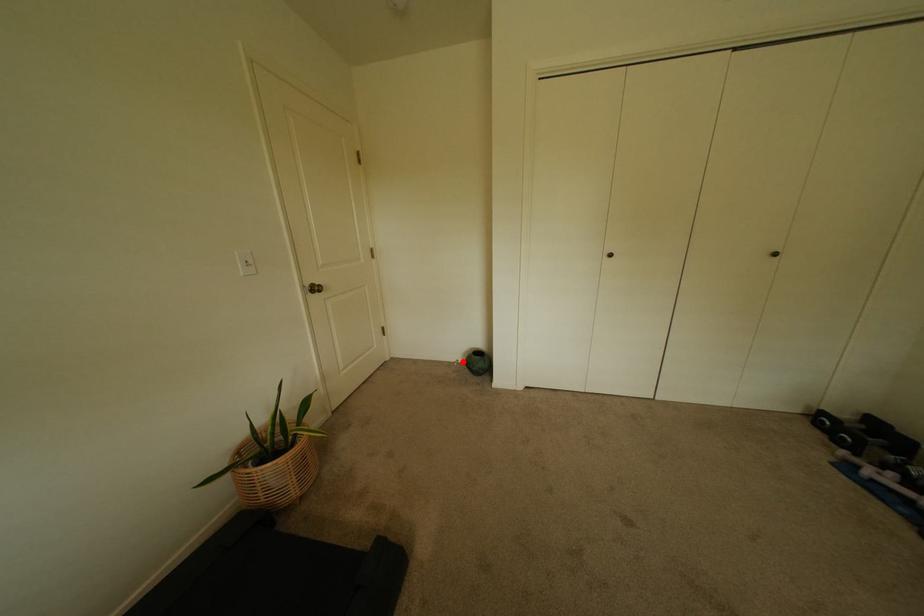
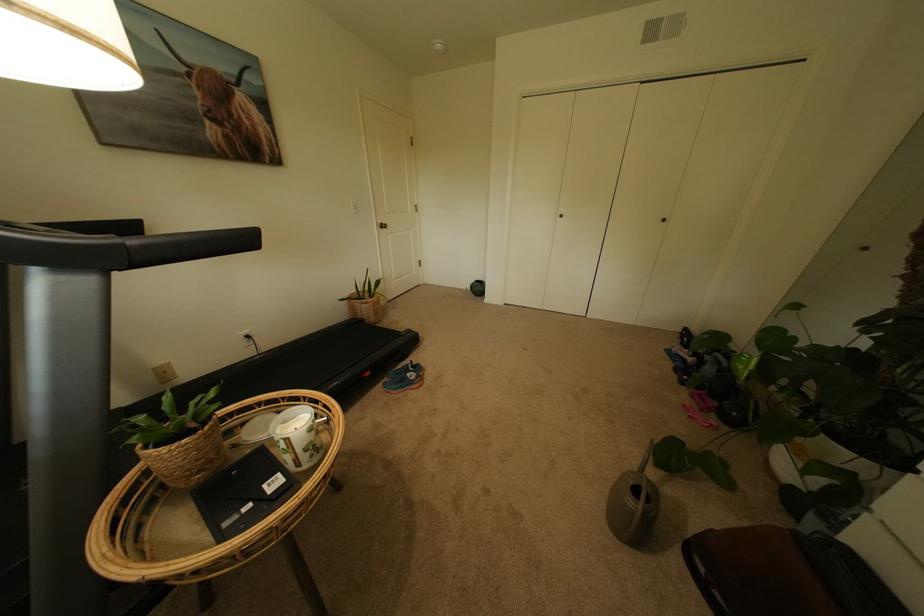
Question: I am providing you with two images of the same scene from different viewpoints. A red point is shown in image1. For the corresponding object point in image2, is it positioned nearer or farther from the camera?

Choices:
 (A) Nearer
 (B) Farther

Answer: (A)